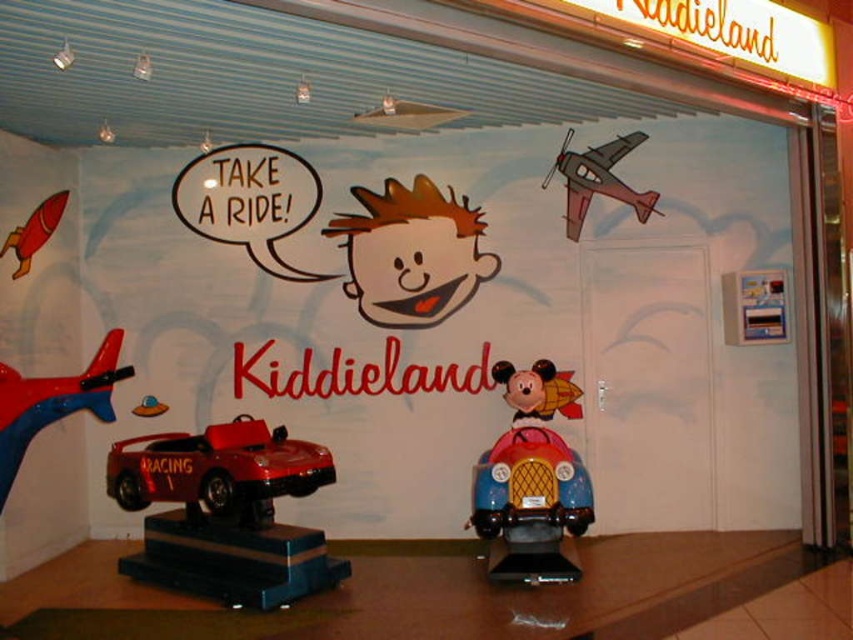
You are a parent holding a child and standing in front of the entrance to Kiddieland. You see the white matte door at center and the metallic red car at lower left. Which object is positioned to the right of the other?

The white matte door at center is to the right of the metallic red car at lower left.

From the picture: You are standing at the entrance of Kiddieland and want to locate two points marked on the wall. The first point is at coordinates point (614, 429) and the second is at point (480, 532). Which point is closer to you?

Point (480, 532) is closer to you because it is in front of point (614, 429).

You are a parent trying to enter the Kiddieland play area through the entrance. You see the white matte door at center and the shiny red rocket at left. Which object is closer to you as you approach the entrance?

The white matte door at center is closer to you because the shiny red rocket at left is behind it.